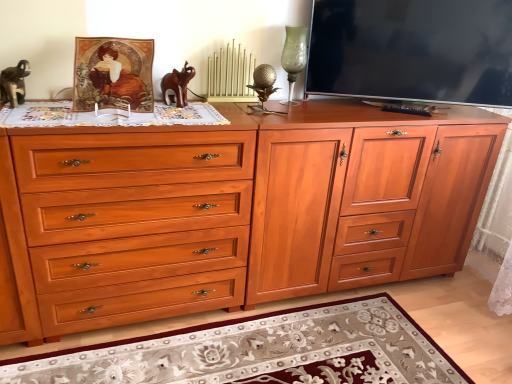
Question: Is matte wood file cabinet at center to the left or to the right of green glass vase at upper center in the image?

Choices:
 (A) left
 (B) right

Answer: (B)

Question: Is point coord(464,172) closer or farther from the camera than point coord(287,49)?

Choices:
 (A) farther
 (B) closer

Answer: (A)

Question: Estimate the real-world distances between objects in this image. Which object is farther from the shiny wood drawer at center?

Choices:
 (A) green glass vase at upper center
 (B) brown wooden elephant at center
 (C) matte wood file cabinet at center
 (D) gold metallic radiator at center
 (E) matte black tv at upper right

Answer: (E)

Question: Estimate the real-world distances between objects in this image. Which object is closer to the gold textured golf ball at center?

Choices:
 (A) matte wood file cabinet at center
 (B) gold metallic radiator at center
 (C) brown wooden elephant at center
 (D) floral rug at lower center
 (E) green glass vase at upper center

Answer: (B)